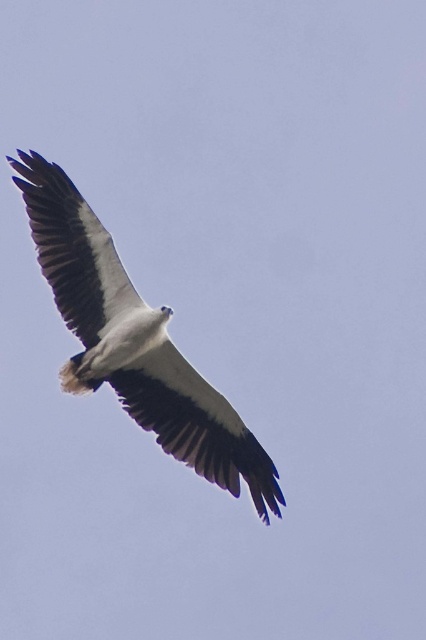
You are a photographer trying to capture the white feathered eagle at center and the white feathered wing at upper left in a single frame. Which object should you focus on first to ensure both are in the frame?

The white feathered eagle at center is larger than the white feathered wing at upper left, so you should focus on the white feathered eagle at center first to ensure both fit within the frame.

You are a photographer trying to capture the bird in flight. You notice two white feathered wings in the image. Which wing is positioned to the right of the other? The options are the white feathered wing at center and the white feathered wing at upper left.

The white feathered wing at center is positioned to the right of the white feathered wing at upper left.

You are a photographer trying to capture the white feathered eagle at center and the white feathered wing at center in a single shot. Which object should appear closer to the camera in the photo?

The white feathered eagle at center is in front of the white feathered wing at center, so the eagle should appear closer to the camera in the photo.